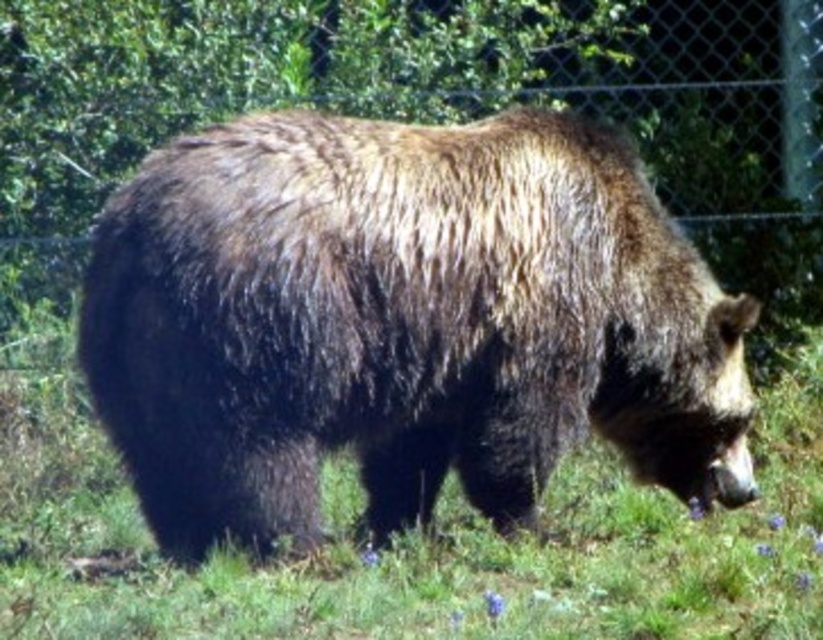
Question: Among these objects, which one is nearest to the camera?

Choices:
 (A) metallic chain-link fence at upper center
 (B) brown fuzzy bear at center

Answer: (B)

Question: Estimate the real-world distances between objects in this image. Which object is farther from the brown fuzzy bear at center?

Choices:
 (A) metallic chain-link fence at upper center
 (B) brown furry bear at center

Answer: (A)

Question: Is metallic chain-link fence at upper center behind brown furry bear at center?

Choices:
 (A) no
 (B) yes

Answer: (B)

Question: Which point appears farthest from the camera in this image?

Choices:
 (A) (2, 582)
 (B) (161, 106)

Answer: (B)

Question: Can you confirm if brown fuzzy bear at center is positioned above brown furry bear at center?

Choices:
 (A) no
 (B) yes

Answer: (B)

Question: Can you confirm if metallic chain-link fence at upper center is positioned above brown furry bear at center?

Choices:
 (A) yes
 (B) no

Answer: (A)